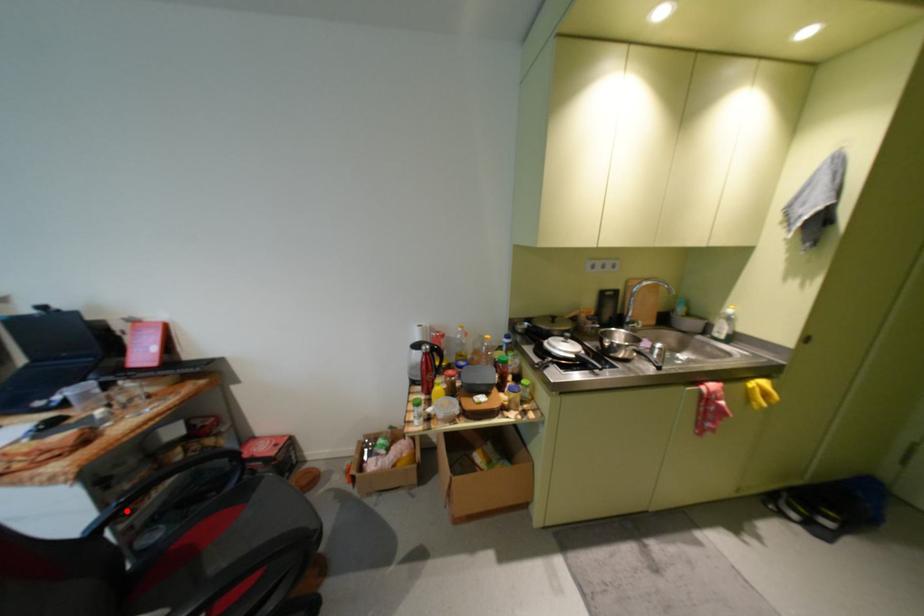
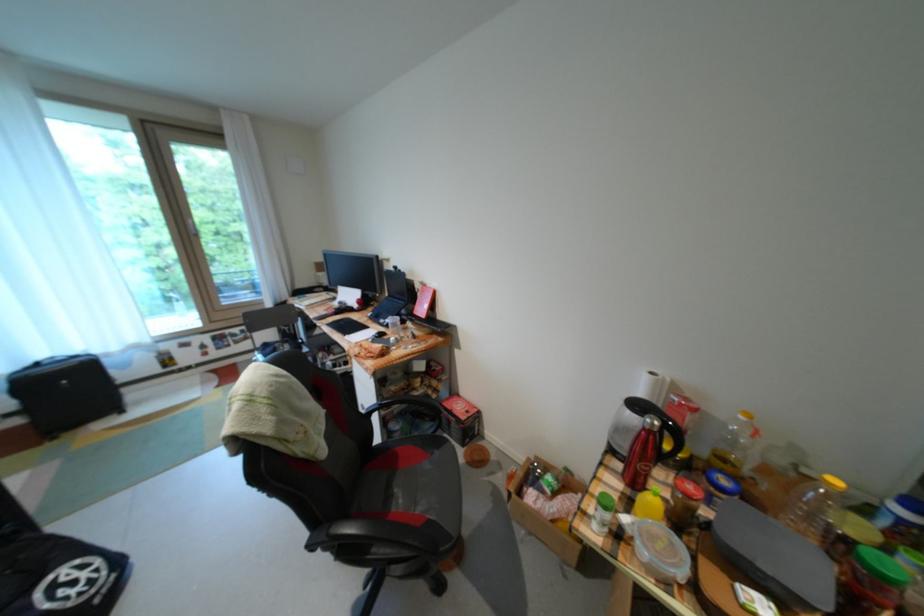
Find the pixel in the second image that matches the highlighted location in the first image.

(387, 407)